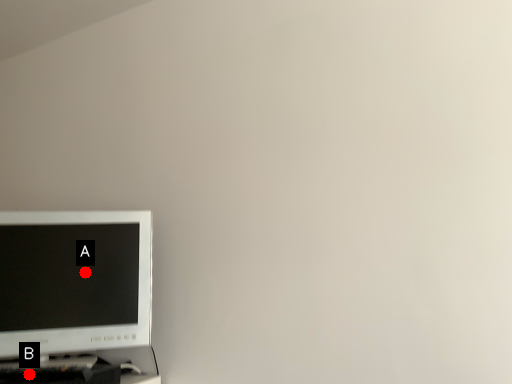
Question: Two points are circled on the image, labeled by A and B beside each circle. Which of the following is the farthest from the observer?

Choices:
 (A) A is further
 (B) B is further

Answer: (A)